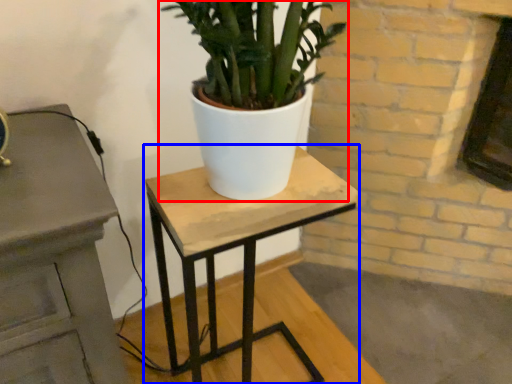
Question: Among these objects, which one is nearest to the camera, houseplant (highlighted by a red box) or table (highlighted by a blue box)?

Choices:
 (A) houseplant
 (B) table

Answer: (A)